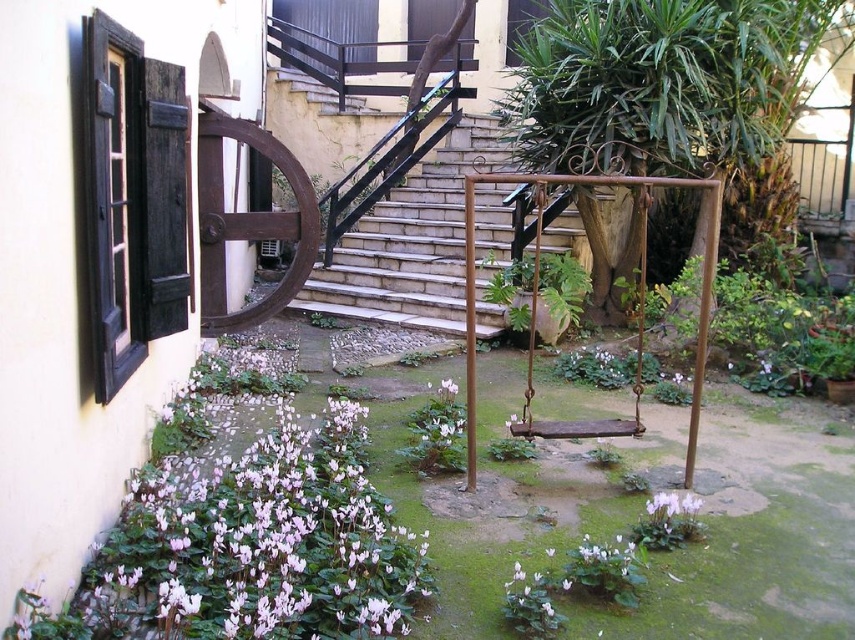
You are standing at the point with coordinates [640,301] in the image. What object are you standing on?

You are standing on the rusty wood swing at center.

You are a painter who needs to place a 2m wide canvas between the rustic metal stairs at center and the rusty wood swing at center. Can the space between them accommodate the canvas?

The rustic metal stairs at center is wider than the rusty wood swing at center, but the exact distance between them isn